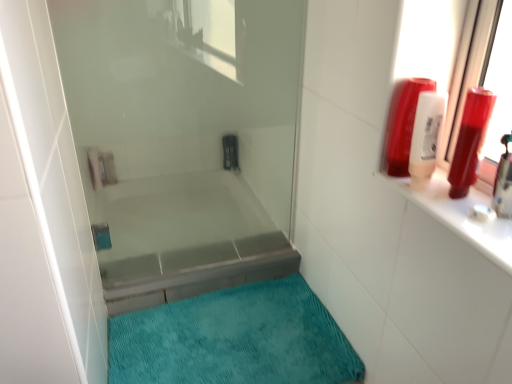
Question: From the image's perspective, would you say matte plastic shampoo bottle at upper right, positioned as the 3th toiletry in right-to-left order, is shown under transparent glass shower door at center?

Choices:
 (A) yes
 (B) no

Answer: (B)

Question: Would you say matte plastic shampoo bottle at upper right, which is counted as the first toiletry, starting from the left, is outside transparent glass shower door at center?

Choices:
 (A) no
 (B) yes

Answer: (B)

Question: Is matte plastic shampoo bottle at upper right, positioned as the 3th toiletry in right-to-left order, closer to camera compared to transparent glass shower door at center?

Choices:
 (A) yes
 (B) no

Answer: (A)

Question: Is matte plastic shampoo bottle at upper right, which is counted as the first toiletry, starting from the left, further to camera compared to transparent glass shower door at center?

Choices:
 (A) no
 (B) yes

Answer: (A)

Question: Is matte plastic shampoo bottle at upper right, which is counted as the first toiletry, starting from the left, smaller than transparent glass shower door at center?

Choices:
 (A) no
 (B) yes

Answer: (B)

Question: From a real-world perspective, relative to transparent glass shower door at center, is teal plush bath mat at lower center vertically above or below?

Choices:
 (A) above
 (B) below

Answer: (B)

Question: Considering the positions of teal plush bath mat at lower center and transparent glass shower door at center in the image, is teal plush bath mat at lower center bigger or smaller than transparent glass shower door at center?

Choices:
 (A) big
 (B) small

Answer: (B)

Question: Does point (286, 367) appear closer or farther from the camera than point (212, 187)?

Choices:
 (A) closer
 (B) farther

Answer: (A)

Question: Which is correct: teal plush bath mat at lower center is inside transparent glass shower door at center, or outside of it?

Choices:
 (A) inside
 (B) outside

Answer: (B)

Question: Is matte plastic shampoo bottle at upper right, positioned as the 3th toiletry in right-to-left order, situated inside metallic silver bathtub at center or outside?

Choices:
 (A) inside
 (B) outside

Answer: (B)

Question: Visually, is matte plastic shampoo bottle at upper right, which is counted as the first toiletry, starting from the left, positioned to the left or to the right of metallic silver bathtub at center?

Choices:
 (A) right
 (B) left

Answer: (A)

Question: Is matte plastic shampoo bottle at upper right, which is counted as the first toiletry, starting from the left, wider or thinner than metallic silver bathtub at center?

Choices:
 (A) wide
 (B) thin

Answer: (B)

Question: Looking at the image, does matte plastic shampoo bottle at upper right, positioned as the 3th toiletry in right-to-left order, seem bigger or smaller compared to metallic silver bathtub at center?

Choices:
 (A) small
 (B) big

Answer: (A)

Question: In terms of height, does transparent glass shower door at center look taller or shorter compared to matte plastic shampoo bottle at upper right, positioned as the 3th toiletry in right-to-left order?

Choices:
 (A) short
 (B) tall

Answer: (B)

Question: From the image's perspective, is transparent glass shower door at center located above or below matte plastic shampoo bottle at upper right, which is counted as the first toiletry, starting from the left?

Choices:
 (A) below
 (B) above

Answer: (A)